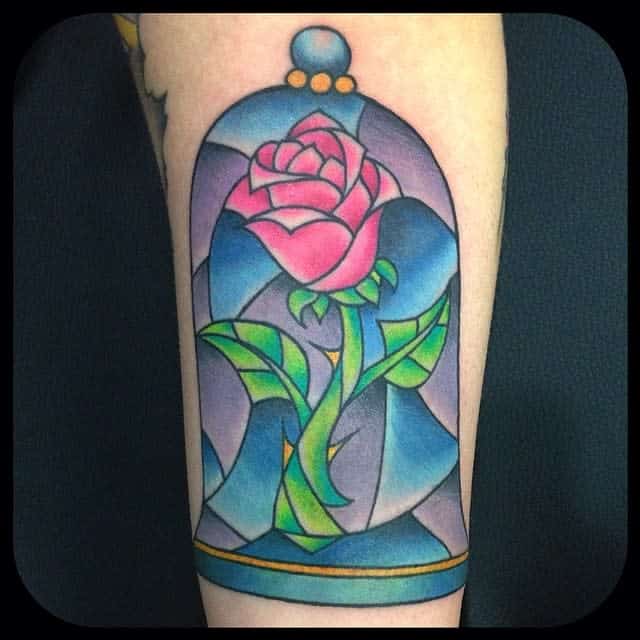
Where is `stained glass rose from beauty and the beast`? This screenshot has width=640, height=640. stained glass rose from beauty and the beast is located at coordinates (313, 201).